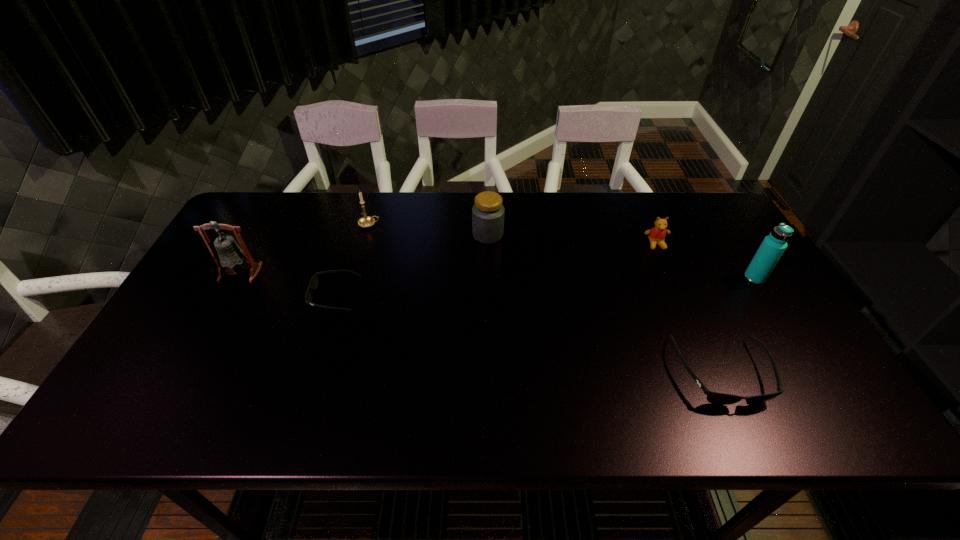
Image resolution: width=960 pixels, height=540 pixels. I want to click on jar positioned at the far edge, so click(488, 212).

Find the location of a particular element. The width and height of the screenshot is (960, 540). object located at the near edge is located at coordinates (717, 398).

What are the coordinates of `object that is at the left edge` in the screenshot? It's located at (229, 255).

Find the location of a particular element. sunglasses that is at the right edge is located at coordinates [717, 398].

Where is `water bottle present at the right edge`? This screenshot has width=960, height=540. water bottle present at the right edge is located at coordinates (771, 249).

The image size is (960, 540). Find the location of `object located in the near right corner section of the desktop`. object located in the near right corner section of the desktop is located at coordinates (717, 398).

This screenshot has width=960, height=540. In order to click on free spot at the far edge of the desktop in this screenshot , I will do `click(519, 193)`.

This screenshot has width=960, height=540. In the image, there is a desktop. What are the coordinates of `free space at the near edge` in the screenshot? It's located at (524, 366).

This screenshot has height=540, width=960. In order to click on vacant space at the left edge in this screenshot , I will do `click(153, 349)`.

Locate an element on the screen. This screenshot has width=960, height=540. free space at the right edge of the desktop is located at coordinates (760, 335).